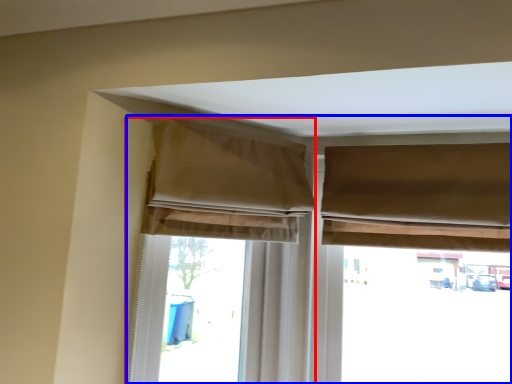
Question: Which object is closer to the camera taking this photo, curtain (highlighted by a red box) or window (highlighted by a blue box)?

Choices:
 (A) curtain
 (B) window

Answer: (A)